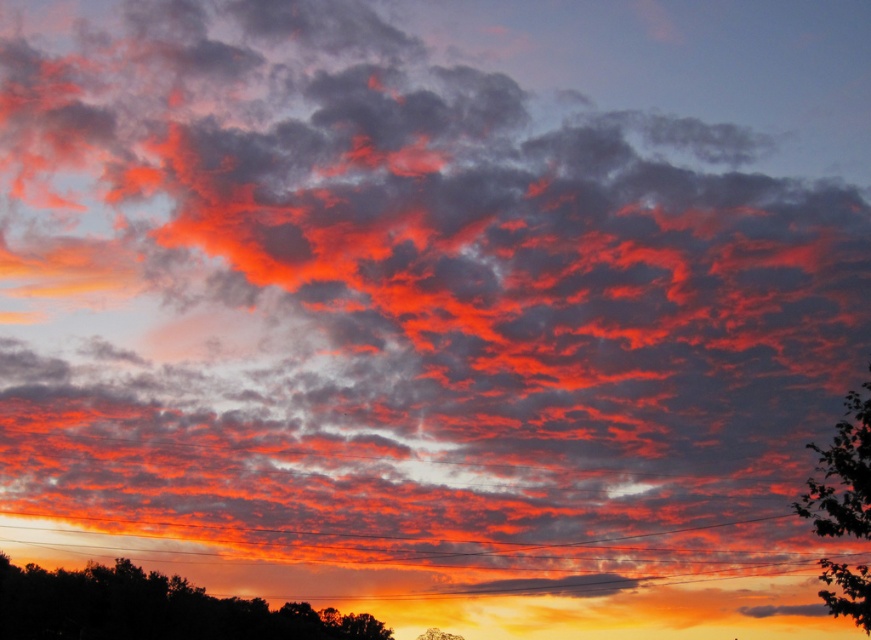
From the picture: You are standing in the sunset scene and want to walk towards the green leafy tree at right and the green leafy tree at lower center. Which tree will you reach first?

The green leafy tree at right is closer to the viewer than the green leafy tree at lower center, so you will reach the green leafy tree at right first.